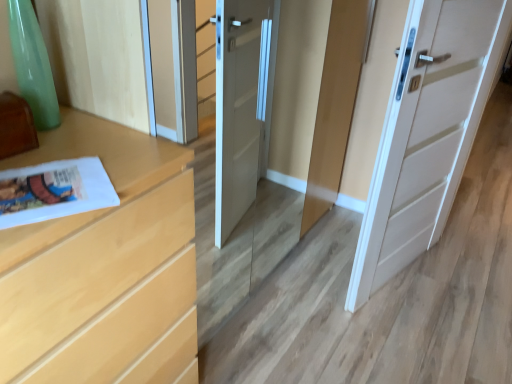
At what (x,y) coordinates should I click in order to perform the action: click on vacant region above white glossy magazine at lower left (from a real-world perspective). Please return your answer as a coordinate pair (x, y). Looking at the image, I should click on (40, 182).